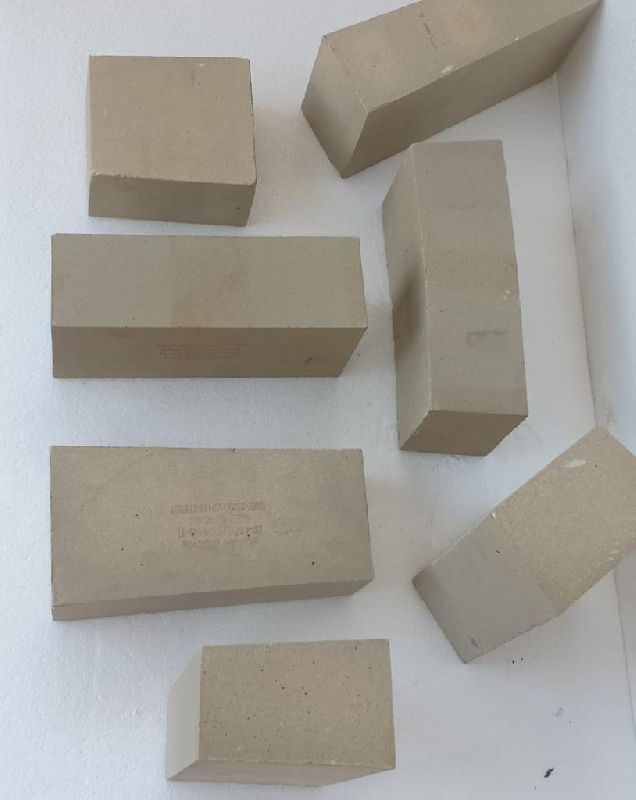
Where is `gray floor`? This screenshot has width=636, height=800. gray floor is located at coordinates (90, 720).